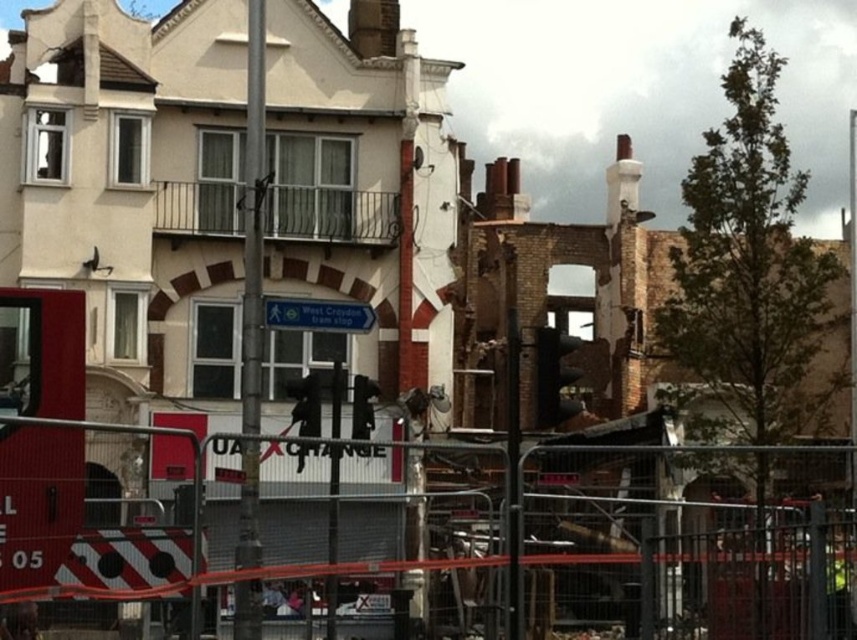
Is point (700, 556) closer to viewer compared to point (259, 332)?

Yes, point (700, 556) is in front of point (259, 332).

Which is in front, point (740, 506) or point (253, 429)?

Positioned in front is point (253, 429).

Does point (762, 589) come behind point (264, 3)?

No, (762, 589) is in front of (264, 3).

Where is `metal fence at center`? This screenshot has width=857, height=640. metal fence at center is located at coordinates (730, 568).

Which is more to the right, metallic pole at center or blue plastic street sign at center?

blue plastic street sign at center

Between metallic pole at center and blue plastic street sign at center, which one has more height?

metallic pole at center

Is point (256, 508) farther from camera compared to point (286, 305)?

That is False.

Where is `metallic pole at center`? The width and height of the screenshot is (857, 640). metallic pole at center is located at coordinates (252, 291).

Can you confirm if metal fence at center is positioned to the left of blue plastic street sign at center?

Incorrect, metal fence at center is not on the left side of blue plastic street sign at center.

You are a GUI agent. You are given a task and a screenshot of the screen. Output one action in this format:
    pyautogui.click(x=<x>, y=<y>)
    Task: Click on the metal fence at center
    This screenshot has height=640, width=857.
    Given the screenshot: What is the action you would take?
    pyautogui.click(x=730, y=568)

Locate an element on the screen. This screenshot has width=857, height=640. metal fence at center is located at coordinates (730, 568).